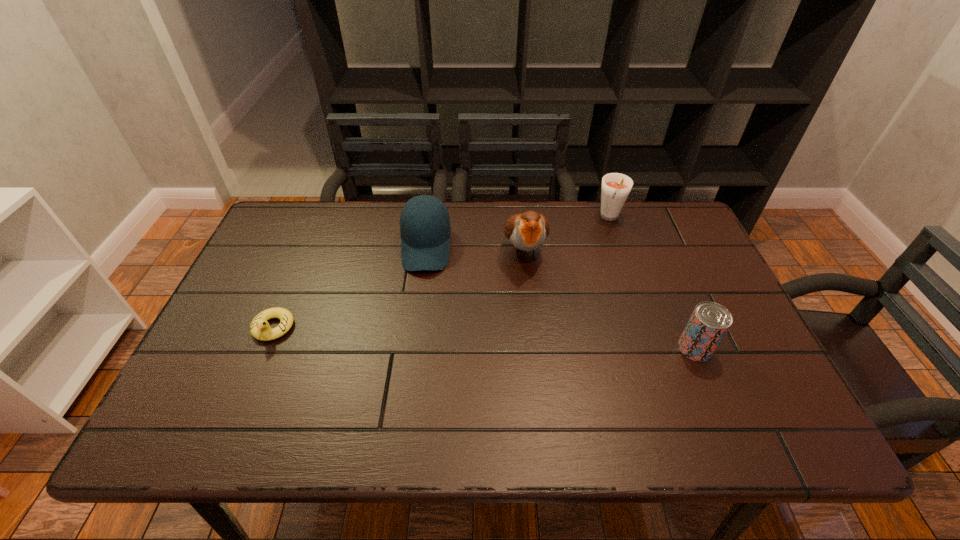
Where is `object present at the left edge`? This screenshot has width=960, height=540. object present at the left edge is located at coordinates (260, 329).

This screenshot has height=540, width=960. In order to click on object that is at the right edge in this screenshot , I will do `click(709, 322)`.

This screenshot has width=960, height=540. Find the location of `vacant space at the far edge of the desktop`. vacant space at the far edge of the desktop is located at coordinates (390, 205).

Find the location of a particular element. The width and height of the screenshot is (960, 540). vacant space at the near edge of the desktop is located at coordinates (542, 403).

You are a GUI agent. You are given a task and a screenshot of the screen. Output one action in this format:
    pyautogui.click(x=<x>, y=<y>)
    Task: Click on the free space at the right edge of the desktop
    
    Given the screenshot: What is the action you would take?
    pyautogui.click(x=700, y=267)

Locate an element on the screen. The height and width of the screenshot is (540, 960). free point at the far left corner is located at coordinates (288, 225).

Find the location of `vacant area between the second object from right to left and the third object from right to left`. vacant area between the second object from right to left and the third object from right to left is located at coordinates (567, 235).

Find the location of a particular element. empty space between the rightmost object and the fourth object from left to right is located at coordinates (653, 284).

I want to click on vacant space that's between the fourth object from left to right and the bird, so click(567, 235).

This screenshot has width=960, height=540. Find the location of `unoccupied position between the rightmost object and the root beer`. unoccupied position between the rightmost object and the root beer is located at coordinates (653, 284).